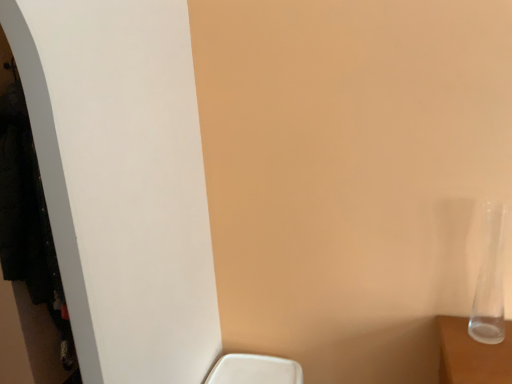
Find the location of a particular element. Image resolution: width=512 pixels, height=384 pixels. white matte closet at left is located at coordinates (28, 237).

This screenshot has height=384, width=512. What do you see at coordinates (28, 237) in the screenshot?
I see `white matte closet at left` at bounding box center [28, 237].

What do you see at coordinates (490, 281) in the screenshot?
I see `transparent glass vase at right` at bounding box center [490, 281].

Identify the location of transparent glass vase at right. tap(490, 281).

This screenshot has width=512, height=384. In order to click on white matte closet at left in this screenshot , I will do (x=28, y=237).

Is white matte closet at left to the left of transparent glass vase at right from the viewer's perspective?

Correct, you'll find white matte closet at left to the left of transparent glass vase at right.

Who is more distant, white matte closet at left or transparent glass vase at right?

Positioned behind is white matte closet at left.

Does point (15, 118) appear closer or farther from the camera than point (499, 293)?

Point (15, 118) is positioned farther from the camera compared to point (499, 293).

From the image's perspective, which object appears higher, white matte closet at left or transparent glass vase at right?

From the image's view, transparent glass vase at right is above.

From a real-world perspective, who is located lower, white matte closet at left or transparent glass vase at right?

white matte closet at left, from a real-world perspective.

Considering the sizes of white matte closet at left and transparent glass vase at right in the image, is white matte closet at left wider or thinner than transparent glass vase at right?

Considering their sizes, white matte closet at left looks broader than transparent glass vase at right.

Does white matte closet at left have a lesser height compared to transparent glass vase at right?

No, white matte closet at left is not shorter than transparent glass vase at right.

Looking at the image, does white matte closet at left seem bigger or smaller compared to transparent glass vase at right?

Considering their sizes, white matte closet at left takes up more space than transparent glass vase at right.

Is white matte closet at left surrounding transparent glass vase at right?

No, transparent glass vase at right is not surrounded by white matte closet at left.

Is white matte closet at left positioned far away from transparent glass vase at right?

white matte closet at left is positioned a significant distance from transparent glass vase at right.

Is white matte closet at left looking in the opposite direction of transparent glass vase at right?

No, white matte closet at left is not facing the opposite direction of transparent glass vase at right.

How different are the orientations of white matte closet at left and transparent glass vase at right in degrees?

There is a 0.952-degree angle between the facing directions of white matte closet at left and transparent glass vase at right.

The width and height of the screenshot is (512, 384). In order to click on closet on the left of transparent glass vase at right in this screenshot , I will do `click(28, 237)`.

In the image, is transparent glass vase at right on the left side or the right side of white matte closet at left?

Clearly, transparent glass vase at right is on the right of white matte closet at left in the image.

Is transparent glass vase at right in front of or behind white matte closet at left in the image?

In the image, transparent glass vase at right appears in front of white matte closet at left.

Does point (496, 226) come farther from viewer compared to point (23, 213)?

No, (496, 226) is in front of (23, 213).

From the image's perspective, is transparent glass vase at right located above white matte closet at left?

Correct, transparent glass vase at right appears higher than white matte closet at left in the image.

From the picture: From a real-world perspective, which object rests below the other?

white matte closet at left, from a real-world perspective.

Considering the sizes of transparent glass vase at right and white matte closet at left in the image, is transparent glass vase at right wider or thinner than white matte closet at left?

In the image, transparent glass vase at right appears to be more narrow than white matte closet at left.

Can you confirm if transparent glass vase at right is shorter than white matte closet at left?

Indeed, transparent glass vase at right has a lesser height compared to white matte closet at left.

Between transparent glass vase at right and white matte closet at left, which one has larger size?

white matte closet at left is bigger.

Is transparent glass vase at right not inside white matte closet at left?

Yes, transparent glass vase at right is outside of white matte closet at left.

Is transparent glass vase at right far away from white matte closet at left?

Absolutely, transparent glass vase at right is distant from white matte closet at left.

Could you tell me if transparent glass vase at right is turned towards white matte closet at left?

No, transparent glass vase at right is not facing towards white matte closet at left.

How different are the orientations of transparent glass vase at right and white matte closet at left in degrees?

They differ by 0.952 degrees in their facing directions.

The image size is (512, 384). What are the coordinates of `glass vase lying on the right of white matte closet at left` in the screenshot? It's located at (490, 281).

At what (x,y) coordinates should I click in order to perform the action: click on glass vase located above the white matte closet at left (from a real-world perspective). Please return your answer as a coordinate pair (x, y). Image resolution: width=512 pixels, height=384 pixels. Looking at the image, I should click on (490, 281).

This screenshot has width=512, height=384. Identify the location of glass vase on the right of white matte closet at left. (490, 281).